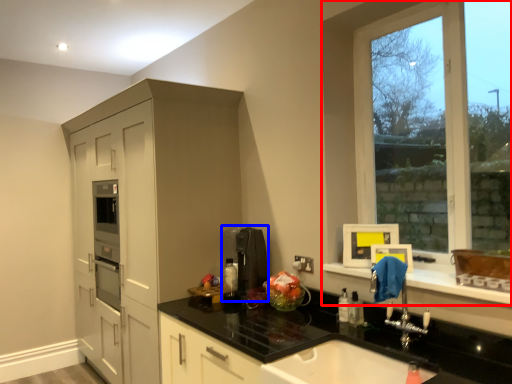
Question: Which of the following is the farthest to the observer, window (highlighted by a red box) or coffee machine (highlighted by a blue box)?

Choices:
 (A) window
 (B) coffee machine

Answer: (B)